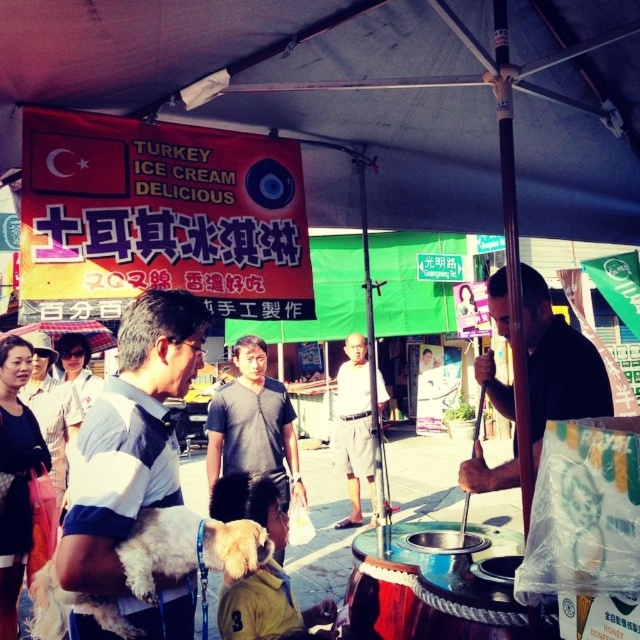
You are a photographer standing in the center of the street scene. You want to take a photo of the light gray cotton shorts at center and the transparent plastic umbrella at upper left. Which object will appear larger in your photo?

The light gray cotton shorts at center will appear larger in the photo because it is closer to the photographer than the transparent plastic umbrella at upper left.

You are a pedestrian trying to walk through the street scene. The black fabric street vendor at center and the transparent plastic umbrella at upper left are in your path. Which object will you need to navigate around more carefully due to its larger size?

The transparent plastic umbrella at upper left requires more careful navigation because it occupies more space than the black fabric street vendor at center.